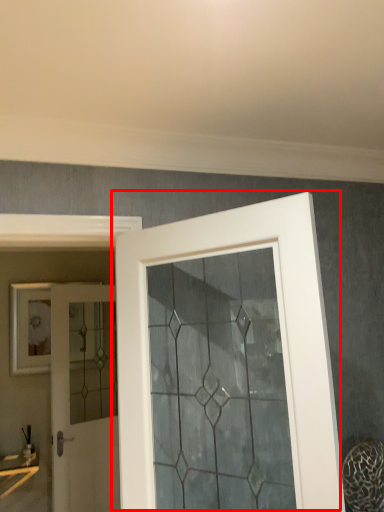
Question: From the image's perspective, where is door (annotated by the red box) located relative to door?

Choices:
 (A) above
 (B) below

Answer: (A)